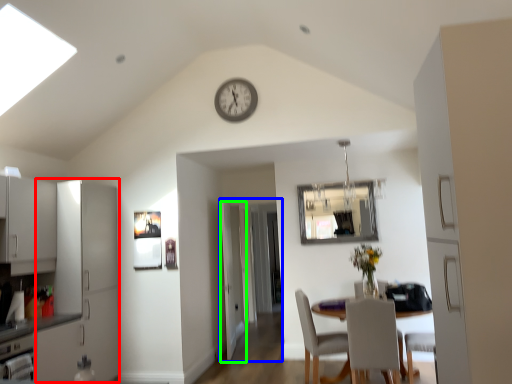
Question: Which is farther away from cabinetry (highlighted by a red box)? glass door (highlighted by a blue box) or door (highlighted by a green box)?

Choices:
 (A) glass door
 (B) door

Answer: (A)